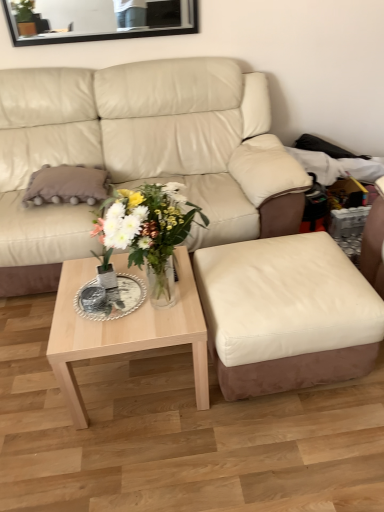
I want to click on vacant space in front of leather ottoman at center, so click(286, 445).